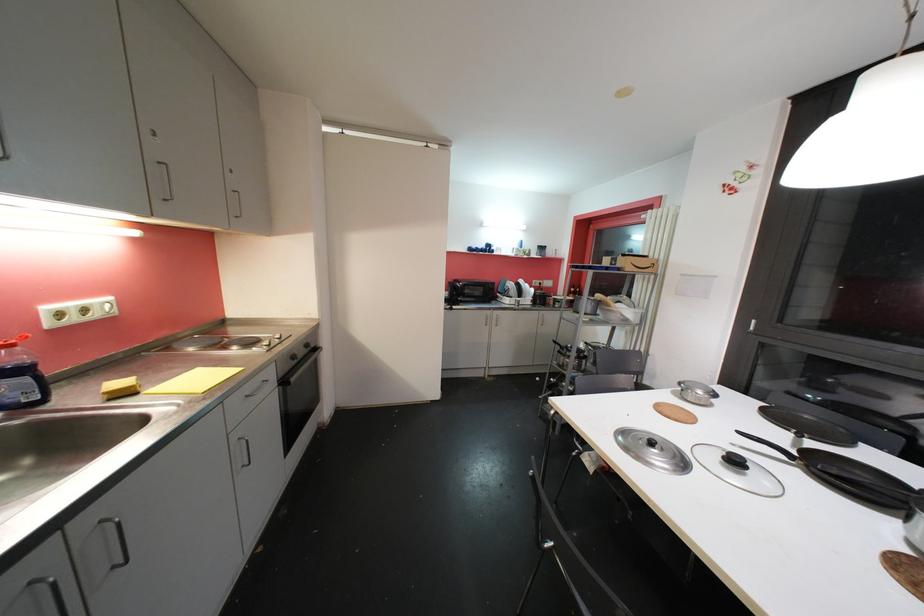
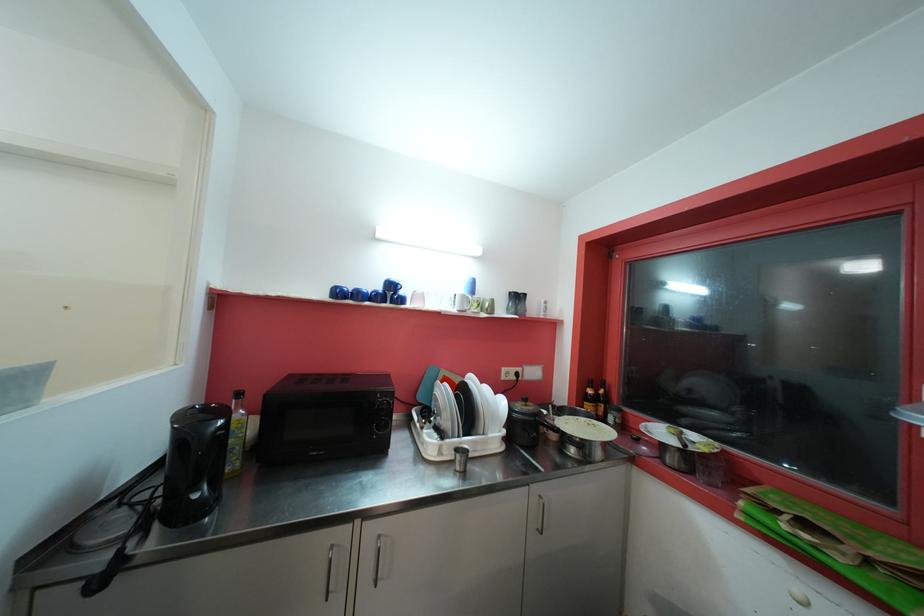
In the second image, find the point that corresponds to the point at 475,252 in the first image.

(343, 294)